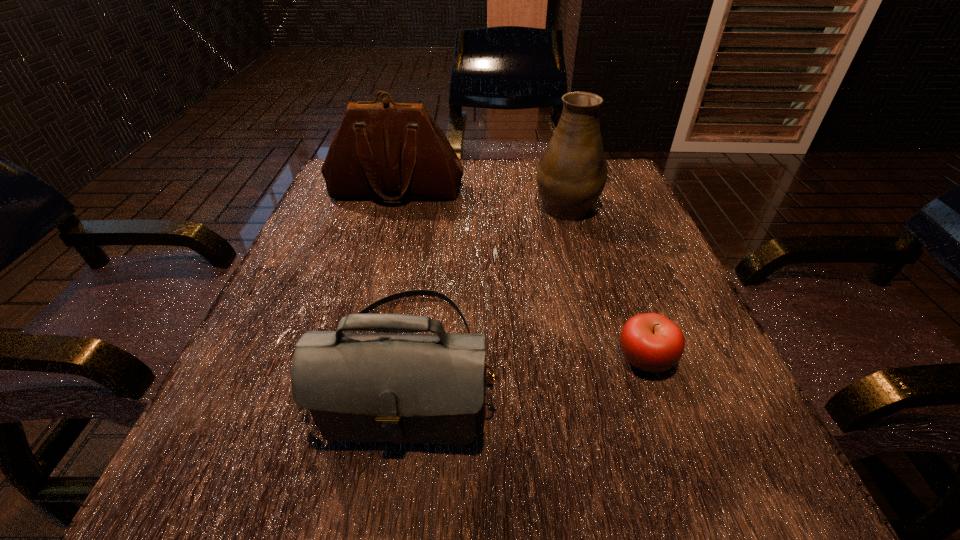
The image size is (960, 540). What are the coordinates of `blank space located 0.270m on the back of the apple` in the screenshot? It's located at (602, 237).

I want to click on pitcher situated at the far edge, so click(571, 175).

You are a GUI agent. You are given a task and a screenshot of the screen. Output one action in this format:
    pyautogui.click(x=<x>, y=<y>)
    Task: Click on the shoulder bag located in the far edge section of the desktop
    Image resolution: width=960 pixels, height=540 pixels.
    Given the screenshot: What is the action you would take?
    pos(391,151)

At what (x,y) coordinates should I click in order to perform the action: click on object positioned at the near edge. Please return your answer as a coordinate pair (x, y). The height and width of the screenshot is (540, 960). Looking at the image, I should click on (359, 387).

You are a GUI agent. You are given a task and a screenshot of the screen. Output one action in this format:
    pyautogui.click(x=<x>, y=<y>)
    Task: Click on the pitcher that is at the right edge
    Image resolution: width=960 pixels, height=540 pixels.
    Given the screenshot: What is the action you would take?
    pyautogui.click(x=571, y=175)

The image size is (960, 540). What are the coordinates of `apple that is at the right edge` in the screenshot? It's located at (650, 342).

The image size is (960, 540). Find the location of `object that is at the far left corner`. object that is at the far left corner is located at coordinates (391, 151).

Find the location of a particular element. object that is at the near left corner is located at coordinates (359, 387).

Locate an element on the screen. object situated at the far right corner is located at coordinates (571, 175).

Identify the location of free spot at the far edge of the desktop. (494, 195).